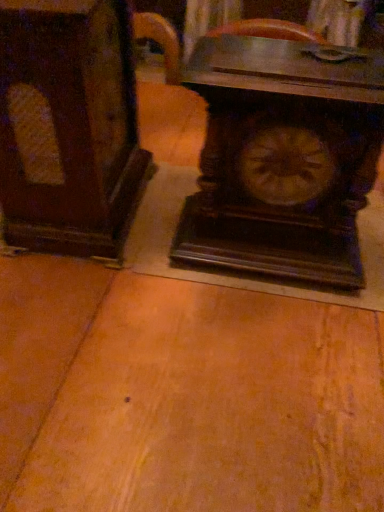
Question: Is dark wood cabinet at left to the left of dark wood table at center from the viewer's perspective?

Choices:
 (A) no
 (B) yes

Answer: (B)

Question: Is dark wood cabinet at left taller than dark wood table at center?

Choices:
 (A) no
 (B) yes

Answer: (A)

Question: Can you confirm if dark wood cabinet at left is smaller than dark wood table at center?

Choices:
 (A) no
 (B) yes

Answer: (B)

Question: Is dark wood table at center surrounded by dark wood cabinet at left?

Choices:
 (A) yes
 (B) no

Answer: (B)

Question: From a real-world perspective, is dark wood cabinet at left on dark wood table at center?

Choices:
 (A) yes
 (B) no

Answer: (A)

Question: Looking at their shapes, would you say dark wood cabinet at left is wider or thinner than wooden carved clock at center?

Choices:
 (A) thin
 (B) wide

Answer: (B)

Question: From a real-world perspective, is dark wood cabinet at left above or below wooden carved clock at center?

Choices:
 (A) below
 (B) above

Answer: (B)

Question: From the image's perspective, relative to wooden carved clock at center, is dark wood cabinet at left above or below?

Choices:
 (A) below
 (B) above

Answer: (B)

Question: Relative to wooden carved clock at center, is dark wood cabinet at left in front or behind?

Choices:
 (A) behind
 (B) front

Answer: (B)

Question: From their relative heights in the image, would you say dark wood table at center is taller or shorter than dark wood cabinet at left?

Choices:
 (A) short
 (B) tall

Answer: (B)

Question: Based on their sizes in the image, would you say dark wood table at center is bigger or smaller than dark wood cabinet at left?

Choices:
 (A) small
 (B) big

Answer: (B)

Question: Which is correct: dark wood table at center is inside dark wood cabinet at left, or outside of it?

Choices:
 (A) inside
 (B) outside

Answer: (B)

Question: From the image's perspective, is dark wood table at center positioned above or below dark wood cabinet at left?

Choices:
 (A) above
 (B) below

Answer: (B)

Question: Is point (61, 131) positioned closer to the camera than point (54, 334)?

Choices:
 (A) closer
 (B) farther

Answer: (A)

Question: Is dark wood cabinet at left in front of or behind dark wood table at center in the image?

Choices:
 (A) behind
 (B) front

Answer: (A)